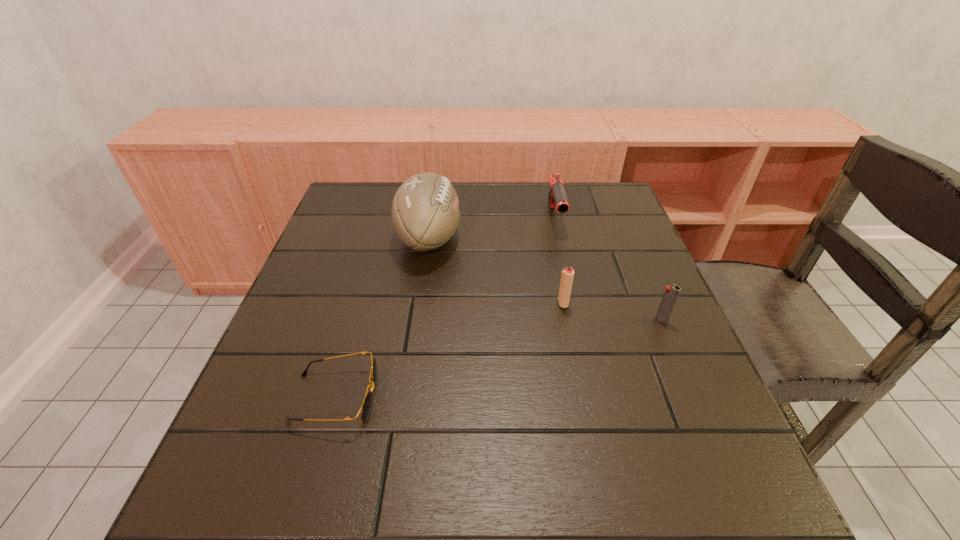
The width and height of the screenshot is (960, 540). In order to click on the tallest object in this screenshot , I will do `click(425, 211)`.

At what (x,y) coordinates should I click in order to perform the action: click on gun. Please return your answer as a coordinate pair (x, y). Image resolution: width=960 pixels, height=540 pixels. Looking at the image, I should click on (557, 196).

Locate an element on the screen. The image size is (960, 540). the third farthest object is located at coordinates (567, 275).

Locate an element on the screen. The height and width of the screenshot is (540, 960). the left igniter is located at coordinates (567, 275).

Locate an element on the screen. Image resolution: width=960 pixels, height=540 pixels. the right igniter is located at coordinates (671, 293).

Where is `the nearer igniter`? the nearer igniter is located at coordinates (671, 293).

Identify the location of sunglasses. (366, 407).

This screenshot has width=960, height=540. I want to click on the nearest object, so click(x=366, y=407).

This screenshot has width=960, height=540. Find the location of `vacant space situated on the laces of the tallest object`. vacant space situated on the laces of the tallest object is located at coordinates pos(512,238).

The width and height of the screenshot is (960, 540). I want to click on vacant region located 0.220m at the aiming end of the gun, so (572, 296).